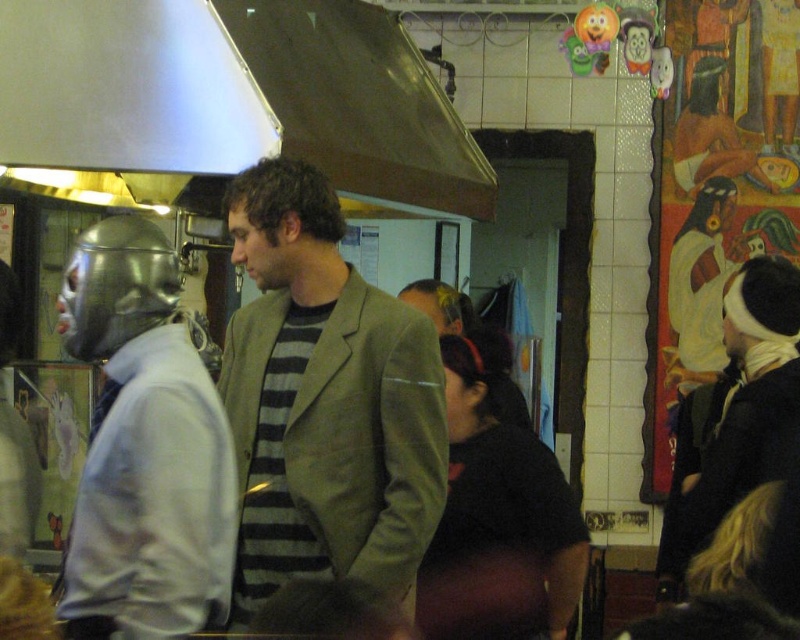
Question: Can you confirm if gray wool blazer at center is positioned below metallic silver helmet at left?

Choices:
 (A) yes
 (B) no

Answer: (B)

Question: Does metallic silver helmet at left appear on the left side of metallic silver exhaust hood at upper center?

Choices:
 (A) yes
 (B) no

Answer: (A)

Question: Estimate the real-world distances between objects in this image. Which object is farther from the metallic silver exhaust hood at upper left?

Choices:
 (A) gray wool blazer at center
 (B) metallic silver exhaust hood at upper center

Answer: (A)

Question: Considering the real-world distances, which object is closest to the metallic silver helmet at left?

Choices:
 (A) gray wool blazer at center
 (B) metallic silver exhaust hood at upper center

Answer: (A)

Question: Among these objects, which one is nearest to the camera?

Choices:
 (A) gray wool blazer at center
 (B) metallic silver exhaust hood at upper left
 (C) metallic silver helmet at left

Answer: (C)

Question: Is the position of metallic silver exhaust hood at upper left more distant than that of metallic silver exhaust hood at upper center?

Choices:
 (A) no
 (B) yes

Answer: (A)